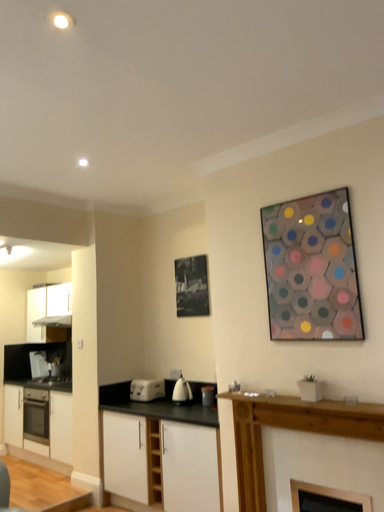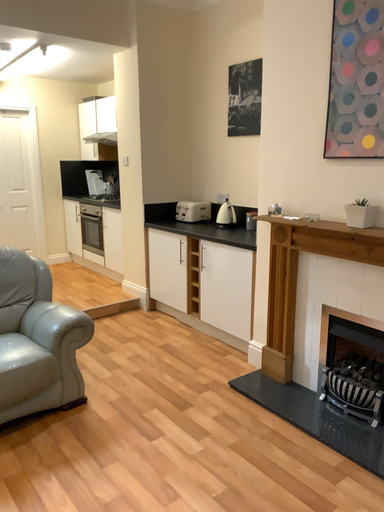
Question: How did the camera likely rotate when shooting the video?

Choices:
 (A) rotated right
 (B) rotated left

Answer: (B)